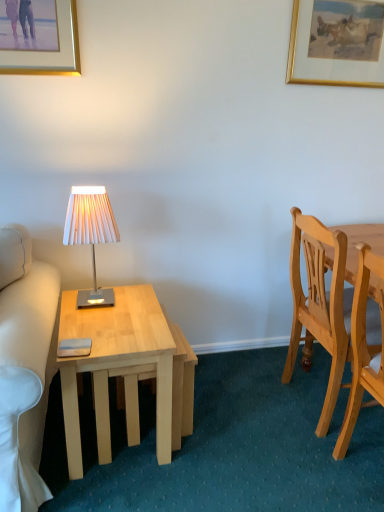
Question: Is the depth of light wood chair at right, arranged as the first chair when viewed from the back, less than that of light wood desk at left?

Choices:
 (A) yes
 (B) no

Answer: (B)

Question: Is light wood chair at right, the second chair positioned from the front, wider than light wood desk at left?

Choices:
 (A) no
 (B) yes

Answer: (A)

Question: Considering the relative sizes of light wood chair at right, arranged as the first chair when viewed from the back, and light wood desk at left in the image provided, is light wood chair at right, arranged as the first chair when viewed from the back, thinner than light wood desk at left?

Choices:
 (A) no
 (B) yes

Answer: (B)

Question: Does light wood chair at right, arranged as the first chair when viewed from the back, have a larger size compared to light wood desk at left?

Choices:
 (A) yes
 (B) no

Answer: (A)

Question: Is light wood desk at left inside light wood chair at right, arranged as the first chair when viewed from the back?

Choices:
 (A) no
 (B) yes

Answer: (A)

Question: From their relative heights in the image, would you say white pleated fabric lampshade at left is taller or shorter than light wood desk at left?

Choices:
 (A) tall
 (B) short

Answer: (B)

Question: Does point (72, 244) appear closer or farther from the camera than point (74, 380)?

Choices:
 (A) closer
 (B) farther

Answer: (B)

Question: Is white pleated fabric lampshade at left bigger or smaller than light wood desk at left?

Choices:
 (A) small
 (B) big

Answer: (A)

Question: Would you say white pleated fabric lampshade at left is inside or outside light wood desk at left?

Choices:
 (A) inside
 (B) outside

Answer: (B)

Question: Which is correct: gold/golden frame at upper right, which appears as the second picture frame when viewed from the front, is inside light wood chair at right, which is counted as the 2th chair, starting from the back, or outside of it?

Choices:
 (A) inside
 (B) outside

Answer: (B)

Question: From the image's perspective, is gold/golden frame at upper right, the second picture frame viewed from the left, positioned above or below light wood chair at right, which is counted as the 2th chair, starting from the back?

Choices:
 (A) below
 (B) above

Answer: (B)

Question: From a real-world perspective, is gold/golden frame at upper right, the second picture frame viewed from the left, above or below light wood chair at right, which ranks as the first chair in front-to-back order?

Choices:
 (A) above
 (B) below

Answer: (A)

Question: Considering their positions, is gold/golden frame at upper right, which appears as the second picture frame when viewed from the front, located in front of or behind light wood chair at right, which ranks as the first chair in front-to-back order?

Choices:
 (A) behind
 (B) front

Answer: (A)

Question: Is white pleated fabric lampshade at left inside the boundaries of gold/golden frame at upper right, the second picture frame viewed from the left, or outside?

Choices:
 (A) inside
 (B) outside

Answer: (B)

Question: In terms of size, does white pleated fabric lampshade at left appear bigger or smaller than gold/golden frame at upper right, acting as the 1th picture frame starting from the back?

Choices:
 (A) small
 (B) big

Answer: (B)